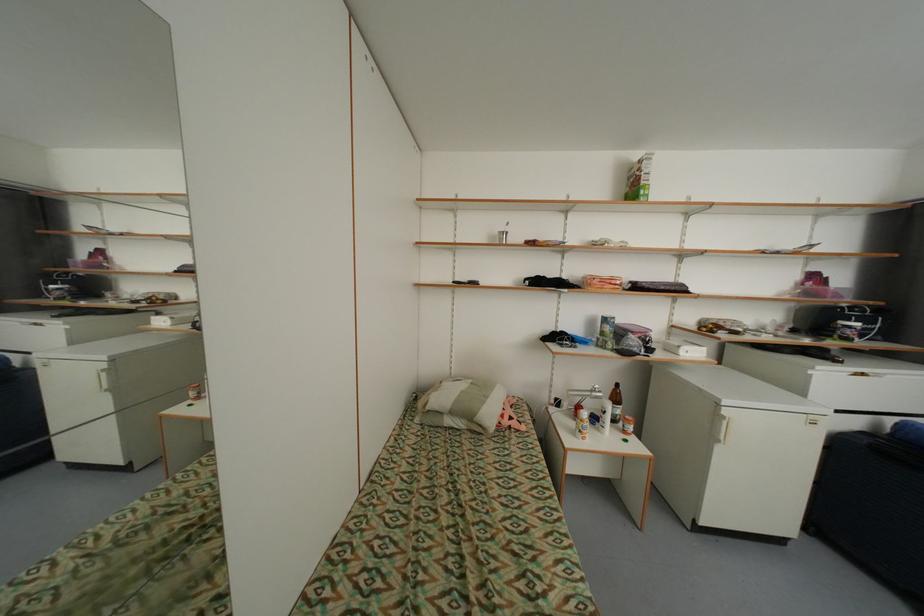
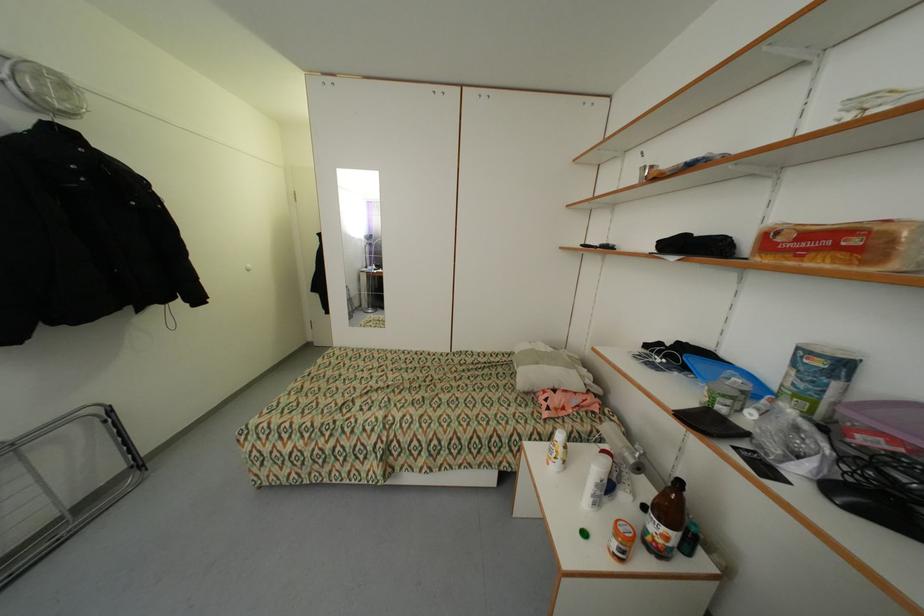
Locate, in the second image, the point that corresponds to (648,334) in the first image.

(900, 440)